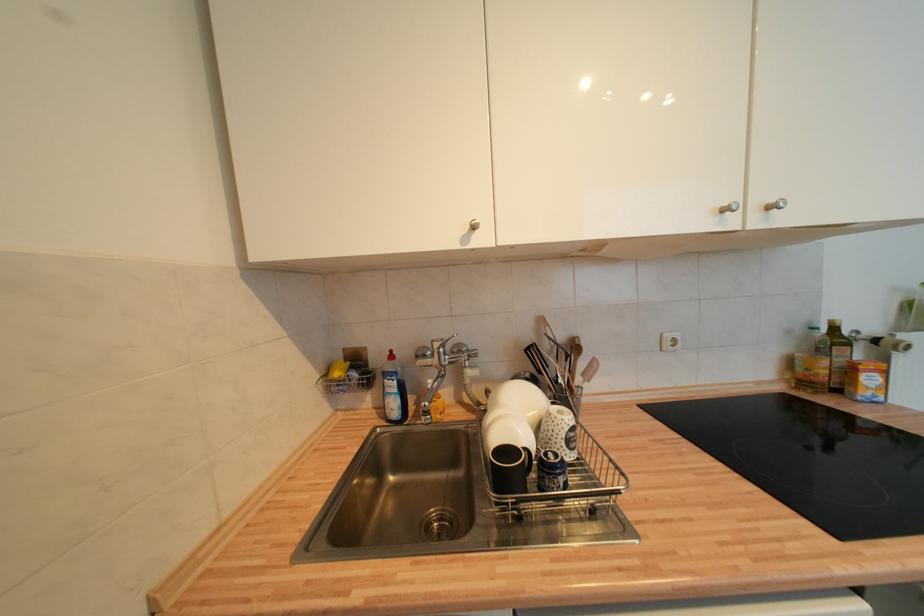
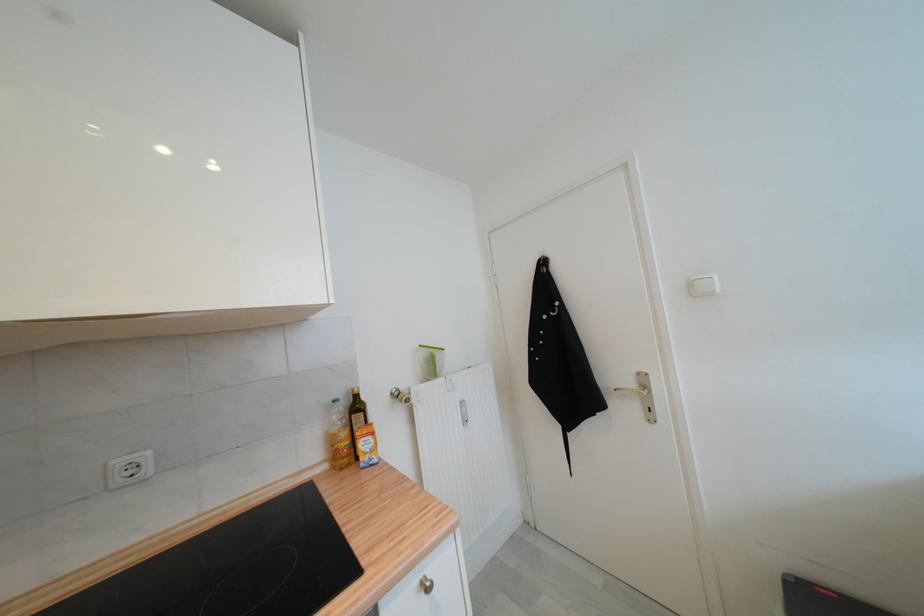
Locate, in the second image, the point that corresponds to point (673, 338) in the first image.

(126, 464)